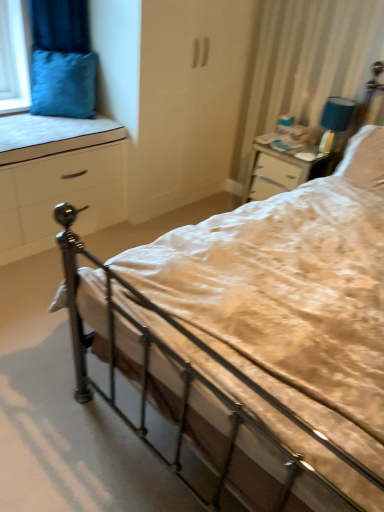
How much space does velvety blue pillow at upper left, which is the second pillow in right-to-left order, occupy horizontally?

It is 12.04 inches.

The width and height of the screenshot is (384, 512). What do you see at coordinates (60, 183) in the screenshot? I see `white matte chest of drawers at left` at bounding box center [60, 183].

The height and width of the screenshot is (512, 384). Describe the element at coordinates (47, 129) in the screenshot. I see `white fabric mattress at left` at that location.

This screenshot has height=512, width=384. Find the location of `velvety blue pillow at upper left, which is the second pillow in right-to-left order`. velvety blue pillow at upper left, which is the second pillow in right-to-left order is located at coordinates (63, 84).

From the image's perspective, between white fabric mattress at left and white soft pillow at upper right, the 2th pillow viewed from the left, who is located below?

white soft pillow at upper right, the 2th pillow viewed from the left.

The image size is (384, 512). Identify the location of pillow below the white fabric mattress at left (from the image's perspective). (364, 158).

Can you confirm if white fabric mattress at left is taller than white soft pillow at upper right, placed as the first pillow when sorted from right to left?

In fact, white fabric mattress at left may be shorter than white soft pillow at upper right, placed as the first pillow when sorted from right to left.

From a real-world perspective, does white fabric mattress at left stand above white soft pillow at upper right, placed as the first pillow when sorted from right to left?

No, from a real-world perspective, white fabric mattress at left is not over white soft pillow at upper right, placed as the first pillow when sorted from right to left

Can you tell me how much white fabric mattress at left and white matte chest of drawers at left differ in facing direction?

They differ by 0.000425 degrees in their facing directions.

From a real-world perspective, does white fabric mattress at left stand above white matte chest of drawers at left?

Yes, from a real-world perspective, white fabric mattress at left is above white matte chest of drawers at left.

Can you confirm if white fabric mattress at left is positioned to the right of white matte chest of drawers at left?

Indeed, white fabric mattress at left is positioned on the right side of white matte chest of drawers at left.

From the image's perspective, would you say blue fabric lampshade at upper right is positioned over white matte chest of drawers at left?

Indeed, from the image's perspective, blue fabric lampshade at upper right is shown above white matte chest of drawers at left.

Does blue fabric lampshade at upper right appear on the right side of white matte chest of drawers at left?

Correct, you'll find blue fabric lampshade at upper right to the right of white matte chest of drawers at left.

Considering the relative sizes of blue fabric lampshade at upper right and white matte chest of drawers at left in the image provided, is blue fabric lampshade at upper right taller than white matte chest of drawers at left?

No, blue fabric lampshade at upper right is not taller than white matte chest of drawers at left.

Which is in front, point (348, 100) or point (123, 128)?

Positioned in front is point (348, 100).

Is velvety blue pillow at upper left, which is the second pillow in right-to-left order, with white fabric mattress at left?

velvety blue pillow at upper left, which is the second pillow in right-to-left order, and white fabric mattress at left are clearly separated.

Is velvety blue pillow at upper left, which is counted as the 1th pillow, starting from the left, aimed at white fabric mattress at left?

Yes, velvety blue pillow at upper left, which is counted as the 1th pillow, starting from the left, is oriented towards white fabric mattress at left.

Can you confirm if velvety blue pillow at upper left, which is the second pillow in right-to-left order, is wider than white fabric mattress at left?

In fact, velvety blue pillow at upper left, which is the second pillow in right-to-left order, might be narrower than white fabric mattress at left.

From the image's perspective, relative to white fabric mattress at left, is velvety blue pillow at upper left, which is the second pillow in right-to-left order, above or below?

From the image's perspective, velvety blue pillow at upper left, which is the second pillow in right-to-left order, appears above white fabric mattress at left.

Between white soft pillow at upper right, the 2th pillow viewed from the left, and velvety blue pillow at upper left, which is the second pillow in right-to-left order, which one appears on the right side from the viewer's perspective?

Positioned to the right is white soft pillow at upper right, the 2th pillow viewed from the left.

Does point (383, 147) lie behind point (83, 73)?

No.

From a real-world perspective, is white soft pillow at upper right, the 2th pillow viewed from the left, physically below velvety blue pillow at upper left, which is the second pillow in right-to-left order?

Correct, in the physical world, white soft pillow at upper right, the 2th pillow viewed from the left, is lower than velvety blue pillow at upper left, which is the second pillow in right-to-left order.

In the scene shown: Is velvety blue pillow at upper left, which is the second pillow in right-to-left order, a part of white soft pillow at upper right, placed as the first pillow when sorted from right to left?

No, velvety blue pillow at upper left, which is the second pillow in right-to-left order, is not surrounded by white soft pillow at upper right, placed as the first pillow when sorted from right to left.

Can you confirm if white fabric mattress at left is wider than velvety blue pillow at upper left, which is the second pillow in right-to-left order?

Correct, the width of white fabric mattress at left exceeds that of velvety blue pillow at upper left, which is the second pillow in right-to-left order.

Consider the image. Is white fabric mattress at left not inside velvety blue pillow at upper left, which is counted as the 1th pillow, starting from the left?

Yes, white fabric mattress at left is located beyond the bounds of velvety blue pillow at upper left, which is counted as the 1th pillow, starting from the left.

Considering the relative positions of white fabric mattress at left and velvety blue pillow at upper left, which is the second pillow in right-to-left order, in the image provided, is white fabric mattress at left to the left of velvety blue pillow at upper left, which is the second pillow in right-to-left order, from the viewer's perspective?

Indeed, white fabric mattress at left is positioned on the left side of velvety blue pillow at upper left, which is the second pillow in right-to-left order.

Is the surface of velvety blue pillow at upper left, which is counted as the 1th pillow, starting from the left, in direct contact with white matte chest of drawers at left?

velvety blue pillow at upper left, which is counted as the 1th pillow, starting from the left, is not next to white matte chest of drawers at left, and they're not touching.

Is white matte chest of drawers at left at the back of velvety blue pillow at upper left, which is counted as the 1th pillow, starting from the left?

No, velvety blue pillow at upper left, which is counted as the 1th pillow, starting from the left, is not facing away from white matte chest of drawers at left.

Would you say white matte chest of drawers at left is part of velvety blue pillow at upper left, which is counted as the 1th pillow, starting from the left,'s contents?

No, white matte chest of drawers at left is located outside of velvety blue pillow at upper left, which is counted as the 1th pillow, starting from the left.

Can you confirm if velvety blue pillow at upper left, which is the second pillow in right-to-left order, is bigger than white matte chest of drawers at left?

No, velvety blue pillow at upper left, which is the second pillow in right-to-left order, is not bigger than white matte chest of drawers at left.

Where is `mattress below the white soft pillow at upper right, the 2th pillow viewed from the left (from a real-world perspective)`? mattress below the white soft pillow at upper right, the 2th pillow viewed from the left (from a real-world perspective) is located at coordinates (47, 129).

In order to click on mattress above the white matte chest of drawers at left (from a real-world perspective) in this screenshot , I will do coord(47,129).

Looking at this image, which object lies nearer to the anchor point white fabric mattress at left, white matte chest of drawers at left or white soft pillow at upper right, placed as the first pillow when sorted from right to left?

white matte chest of drawers at left is closer to white fabric mattress at left.

When comparing their distances from white soft pillow at upper right, the 2th pillow viewed from the left, does blue fabric lampshade at upper right or white fabric mattress at left seem further?

white fabric mattress at left is positioned further to the anchor white soft pillow at upper right, the 2th pillow viewed from the left.

Estimate the real-world distances between objects in this image. Which object is further from white soft pillow at upper right, placed as the first pillow when sorted from right to left, white fabric mattress at left or white matte chest of drawers at left?

white fabric mattress at left.

From the picture: From the image, which object appears to be nearer to velvety blue pillow at upper left, which is counted as the 1th pillow, starting from the left, white matte chest of drawers at left or white fabric mattress at left?

Among the two, white fabric mattress at left is located nearer to velvety blue pillow at upper left, which is counted as the 1th pillow, starting from the left.

Estimate the real-world distances between objects in this image. Which object is further from blue fabric lampshade at upper right, velvety blue pillow at upper left, which is the second pillow in right-to-left order, or white soft pillow at upper right, placed as the first pillow when sorted from right to left?

velvety blue pillow at upper left, which is the second pillow in right-to-left order, lies further to blue fabric lampshade at upper right than the other object.

Estimate the real-world distances between objects in this image. Which object is closer to white soft pillow at upper right, placed as the first pillow when sorted from right to left, white fabric mattress at left or velvety blue pillow at upper left, which is the second pillow in right-to-left order?

The object closer to white soft pillow at upper right, placed as the first pillow when sorted from right to left, is white fabric mattress at left.

Which object lies further to the anchor point white fabric mattress at left, blue fabric lampshade at upper right or white soft pillow at upper right, placed as the first pillow when sorted from right to left?

The object further to white fabric mattress at left is white soft pillow at upper right, placed as the first pillow when sorted from right to left.

Which object lies further to the anchor point white matte chest of drawers at left, white soft pillow at upper right, the 2th pillow viewed from the left, or white fabric mattress at left?

white soft pillow at upper right, the 2th pillow viewed from the left, is positioned further to the anchor white matte chest of drawers at left.

The image size is (384, 512). Find the location of `lamp between velvety blue pillow at upper left, which is the second pillow in right-to-left order, and white soft pillow at upper right, placed as the first pillow when sorted from right to left, from left to right`. lamp between velvety blue pillow at upper left, which is the second pillow in right-to-left order, and white soft pillow at upper right, placed as the first pillow when sorted from right to left, from left to right is located at coordinates (337, 114).

In order to click on pillow between white matte chest of drawers at left and white soft pillow at upper right, placed as the first pillow when sorted from right to left in this screenshot , I will do `click(63, 84)`.

This screenshot has width=384, height=512. What are the coordinates of `lamp between white fabric mattress at left and white soft pillow at upper right, the 2th pillow viewed from the left` in the screenshot? It's located at (337, 114).

This screenshot has width=384, height=512. I want to click on pillow between white fabric mattress at left and blue fabric lampshade at upper right from left to right, so click(x=63, y=84).